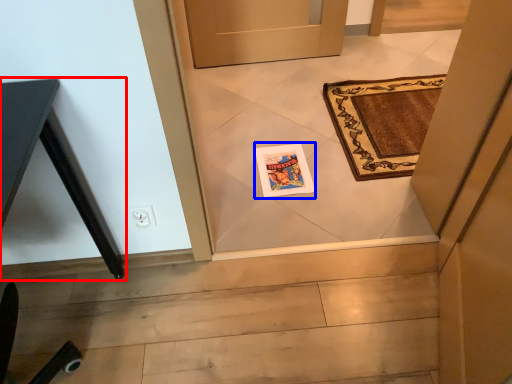
Question: Which point is further to the camera, table (highlighted by a red box) or postcard (highlighted by a blue box)?

Choices:
 (A) table
 (B) postcard

Answer: (B)